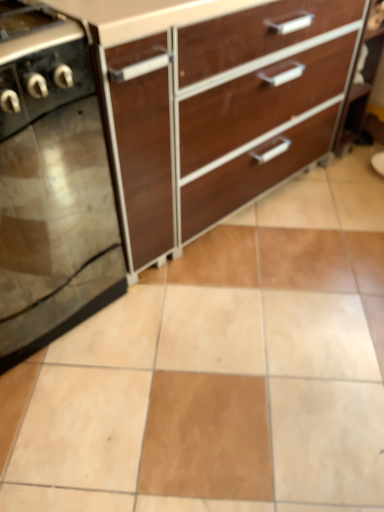
Question: Is black glass stove at left inside or outside of brown wood chest of drawers at upper center?

Choices:
 (A) outside
 (B) inside

Answer: (A)

Question: In terms of width, does black glass stove at left look wider or thinner when compared to brown wood chest of drawers at upper center?

Choices:
 (A) thin
 (B) wide

Answer: (A)

Question: In the image, is black glass stove at left on the left side or the right side of brown wood chest of drawers at upper center?

Choices:
 (A) right
 (B) left

Answer: (B)

Question: Is brown wood chest of drawers at upper center situated inside black glass stove at left or outside?

Choices:
 (A) inside
 (B) outside

Answer: (B)

Question: Considering the relative positions of brown wood chest of drawers at upper center and black glass stove at left in the image provided, is brown wood chest of drawers at upper center to the left or to the right of black glass stove at left?

Choices:
 (A) left
 (B) right

Answer: (B)

Question: From a real-world perspective, is brown wood chest of drawers at upper center physically located above or below black glass stove at left?

Choices:
 (A) above
 (B) below

Answer: (A)

Question: Is brown wood chest of drawers at upper center taller or shorter than black glass stove at left?

Choices:
 (A) short
 (B) tall

Answer: (B)